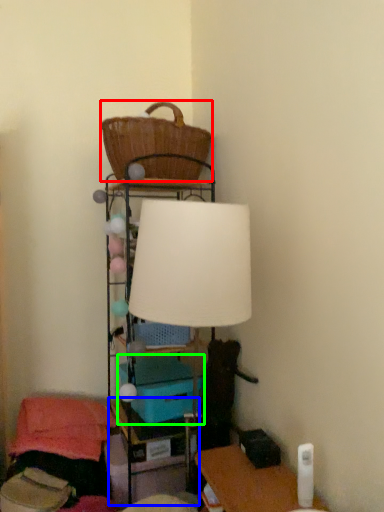
Question: Which is farther away from basket (highlighted by a red box)? table (highlighted by a blue box) or storage box (highlighted by a green box)?

Choices:
 (A) table
 (B) storage box

Answer: (A)